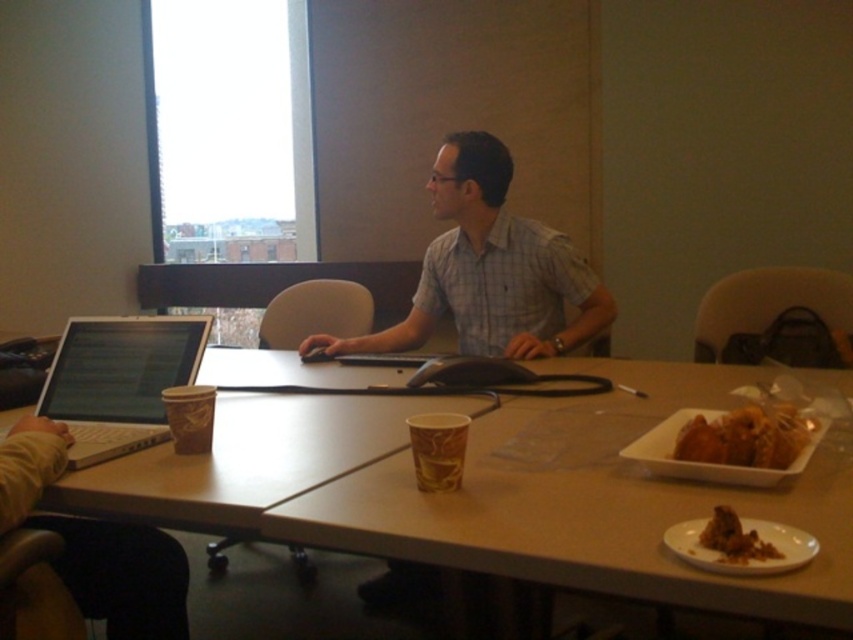
Question: Which of the following is the farthest from the observer?

Choices:
 (A) gray checkered shirt at center
 (B) silver metallic laptop at left

Answer: (A)

Question: Does gray checkered shirt at center lie behind silver metallic laptop at left?

Choices:
 (A) yes
 (B) no

Answer: (A)

Question: Which point appears closest to the camera in this image?

Choices:
 (A) (688, 429)
 (B) (518, 273)

Answer: (A)

Question: Does wooden table at center come behind silver metallic laptop at left?

Choices:
 (A) yes
 (B) no

Answer: (B)

Question: Can you confirm if wooden table at center is positioned above brown crumbly at lower right?

Choices:
 (A) no
 (B) yes

Answer: (B)

Question: Considering the real-world distances, which object is closest to the golden crispy chicken at right?

Choices:
 (A) gray checkered shirt at center
 (B) silver metallic laptop at left

Answer: (B)